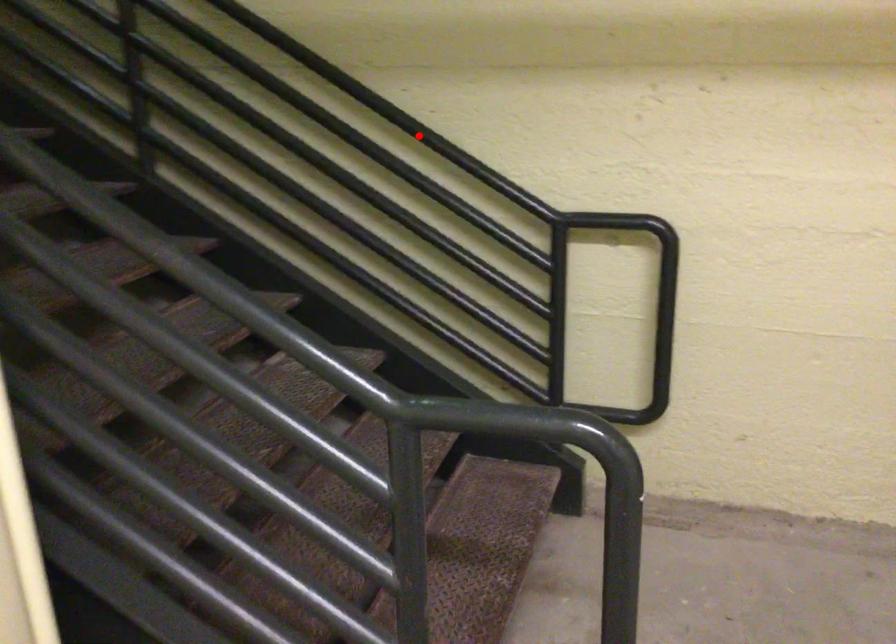
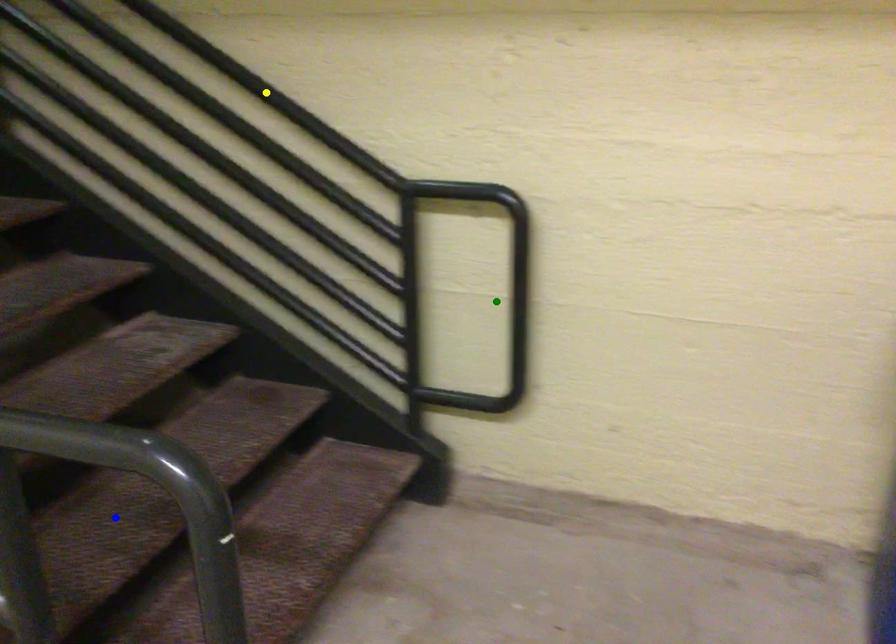
Question: I am providing you with two images of the same scene from different viewpoints. A red point is marked on the first image. You are given multiple points on the second image. In image 2, which mark is for the same physical point as the one in image 1?

Choices:
 (A) green point
 (B) yellow point
 (C) blue point

Answer: (B)